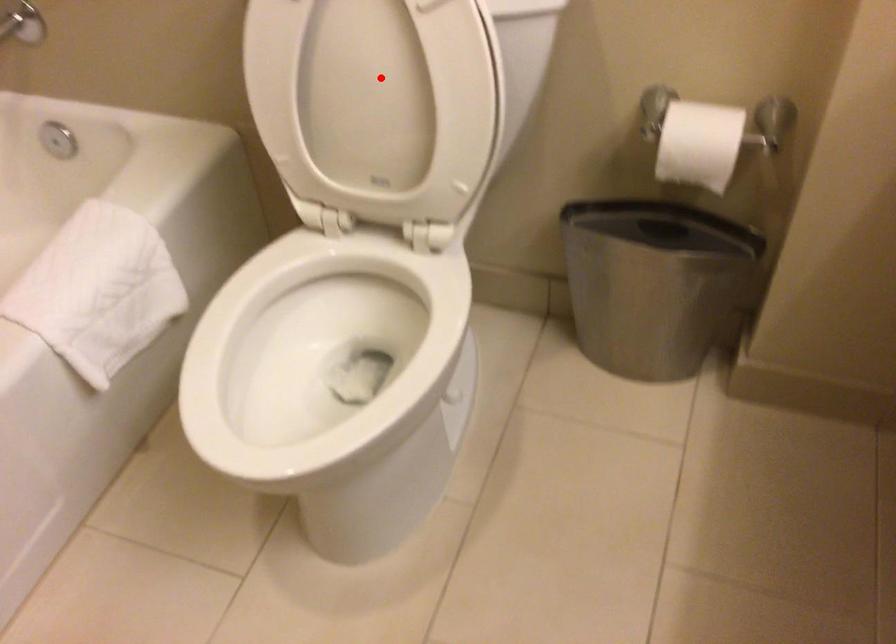
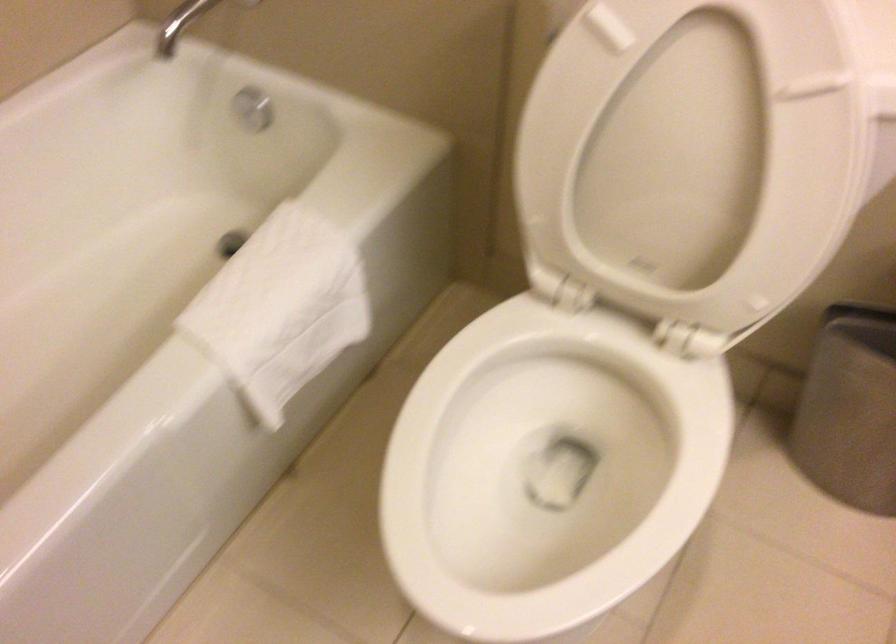
Question: A red point is marked in image1. In image2, is the corresponding 3D point closer to the camera or farther? Reply with the corresponding letter.

Choices:
 (A) The corresponding 3D point is closer.
 (B) The corresponding 3D point is farther.

Answer: (A)